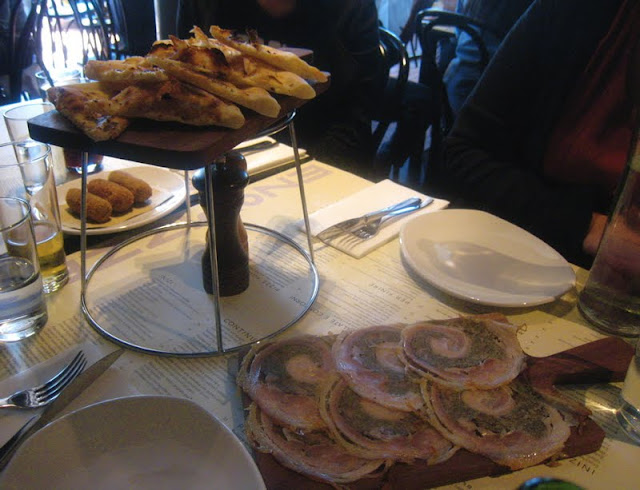
Where is `fork`? The image size is (640, 490). fork is located at coordinates (33, 397), (372, 230).